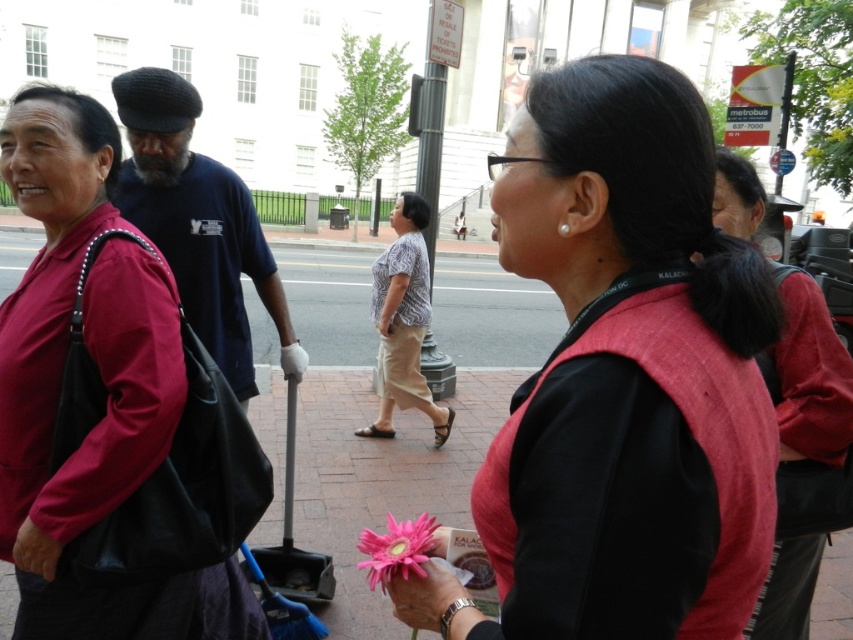
You are standing at the point with coordinates point [662,152] and want to walk towards the point with coordinates point [404,531]. Since both points are in the image, which direction should you move relative to your current position?

Since point [662,152] is closer to the camera than point [404,531], you should move away from the camera to reach the point [404,531].

You are a florist trying to arrange flowers for a customer who wants a tall centerpiece. You have two options in the image, the pink fabric flower at center and the pink matte flower at lower center. Which one should you choose?

The pink fabric flower at center is much taller than the pink matte flower at lower center, so you should choose the pink fabric flower at center for the tall centerpiece.

You are standing in the street scene and want to find the location of the point with coordinates (103, 384). According to the scene description, where is this point located?

The point with coordinates (103, 384) is on the matte black bag at left.